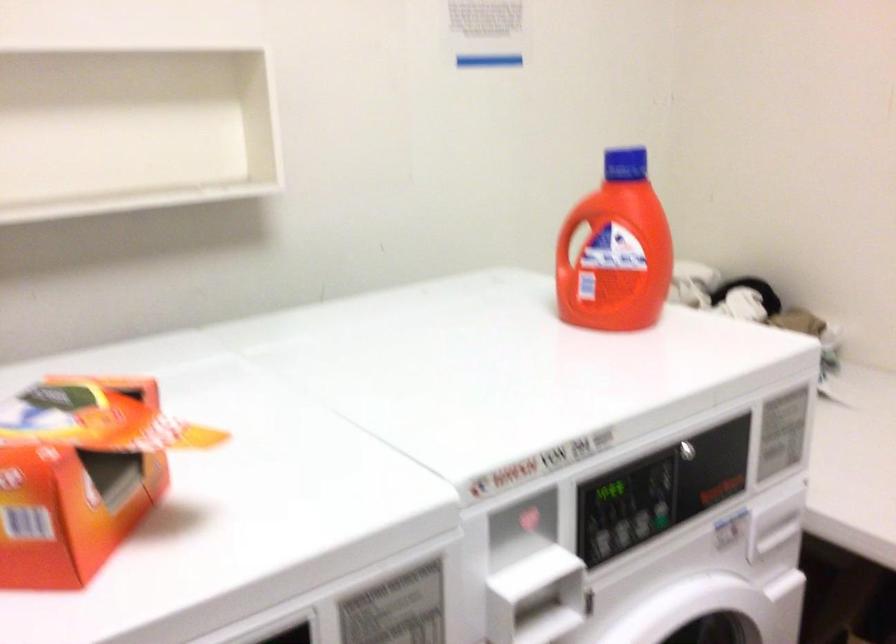
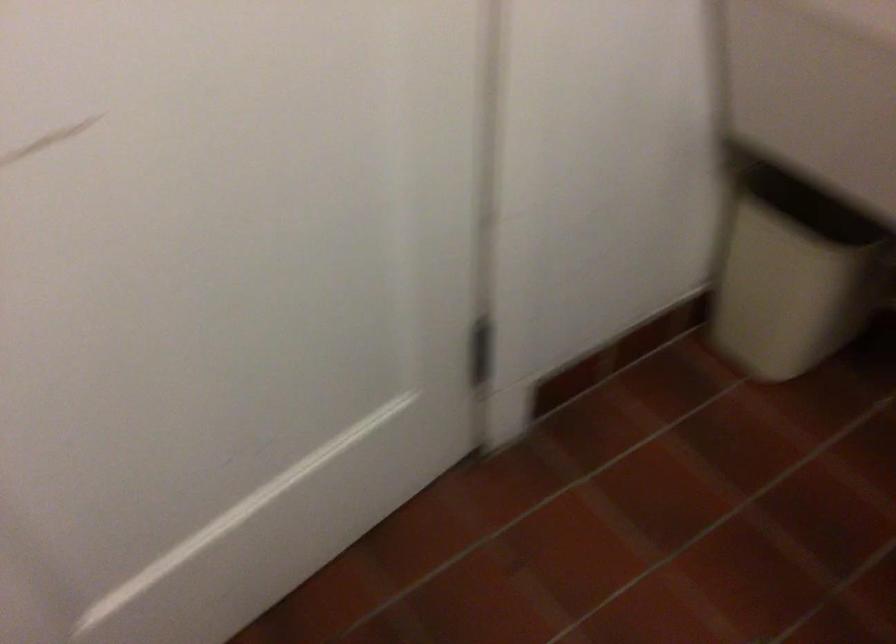
The first image is from the beginning of the video and the second image is from the end. How did the camera likely rotate when shooting the video?

The camera's rotation is toward left-down.